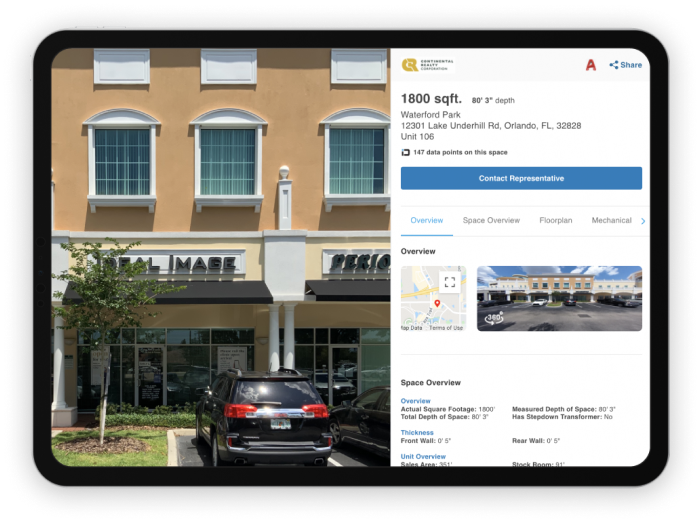
At what (x,y) coordinates should I click in order to perform the action: click on rear wall measurements. Please return your answer as a coordinate pair (x, y). Image resolution: width=700 pixels, height=523 pixels. Looking at the image, I should click on (547, 441).